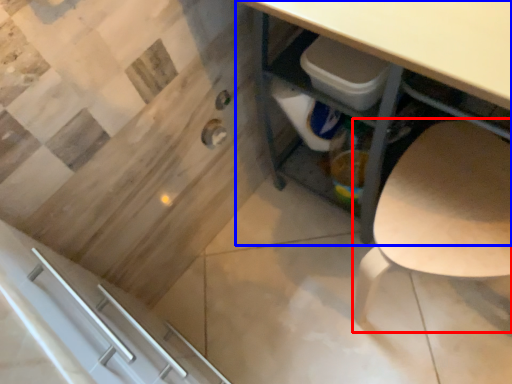
Question: Which point is further to the camera, chair (highlighted by a red box) or desk (highlighted by a blue box)?

Choices:
 (A) chair
 (B) desk

Answer: (A)